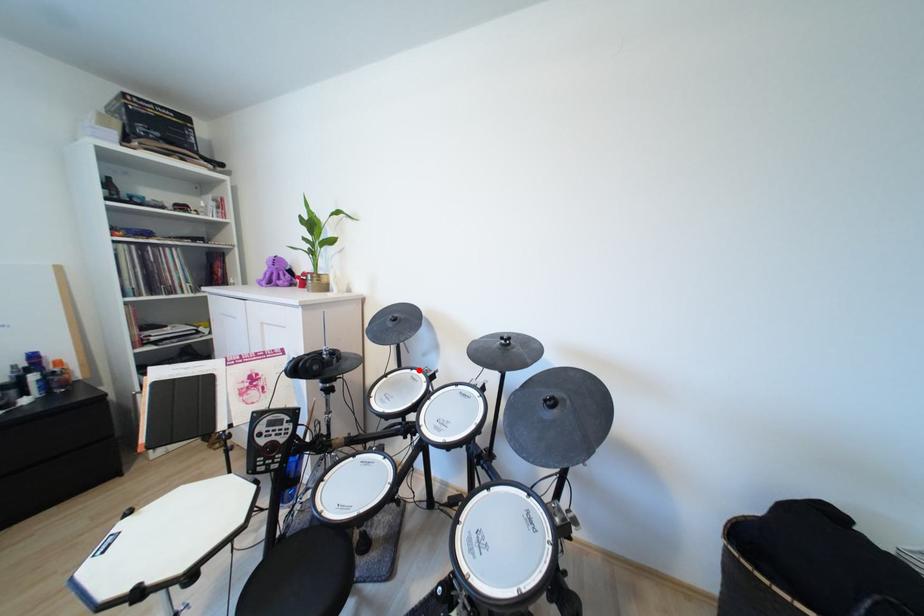
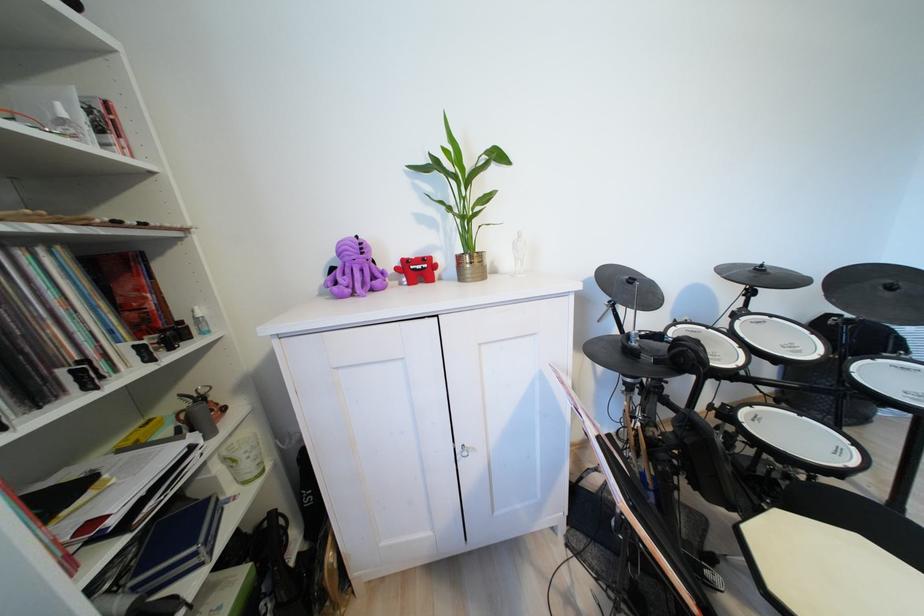
Find the pixel in the second image that matches the highlighted location in the first image.

(682, 326)